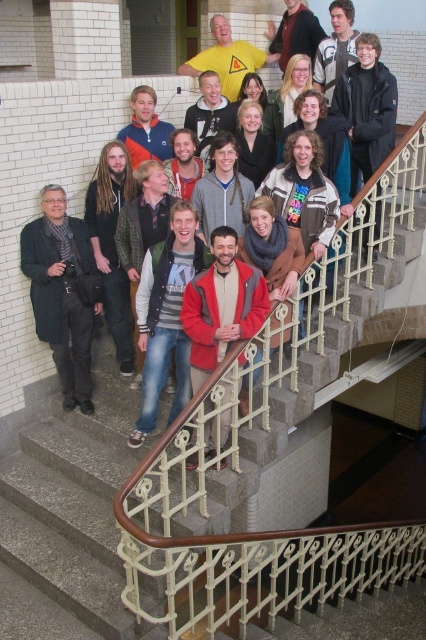
You are standing at the top of the staircase and want to see the dark gray wool coat at left and the matte black jacket at center. Which one is lower in position?

The dark gray wool coat at left is below the matte black jacket at center, so it is lower in position.

You are a photographer trying to arrange two dark brown leather jackets for a photo shoot. You have the dark brown leather jacket at center and the dark brown leather jacket at left. According to the scene, which jacket is positioned to the right of the other?

The dark brown leather jacket at center is positioned to the right of the dark brown leather jacket at left.